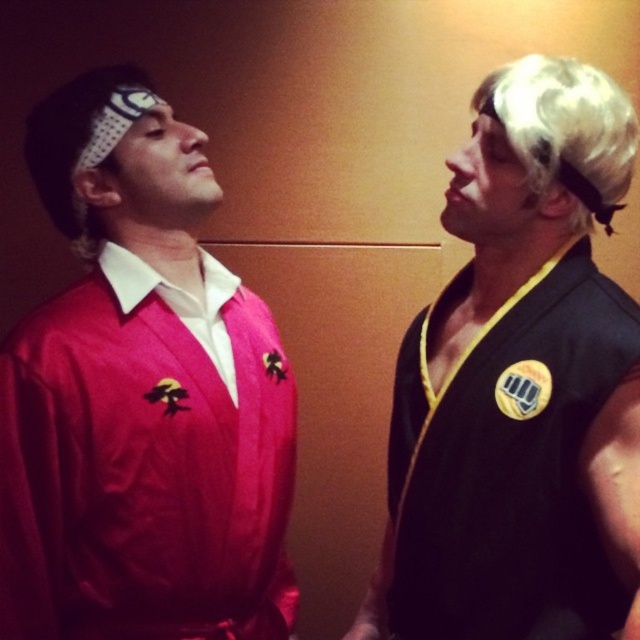
Who is positioned more to the right, matte pink sweater at left or black matte vest at right?

black matte vest at right is more to the right.

Is matte pink sweater at left wider than black matte vest at right?

Yes, matte pink sweater at left is wider than black matte vest at right.

Where is `matte pink sweater at left`? Image resolution: width=640 pixels, height=640 pixels. matte pink sweater at left is located at coordinates (140, 397).

The width and height of the screenshot is (640, 640). What are the coordinates of `matte pink sweater at left` in the screenshot? It's located at (140, 397).

Is point (272, 328) more distant than point (573, 224)?

Yes, point (272, 328) is behind point (573, 224).

Is matte pink sweater at left in front of blonde synthetic wig at upper right?

No, matte pink sweater at left is further to the viewer.

Between point (212, 204) and point (605, 163), which one is positioned behind?

Positioned behind is point (212, 204).

Locate an element on the screen. matte pink sweater at left is located at coordinates (140, 397).

Based on the photo, is black matte vest at right thinner than blonde synthetic wig at upper right?

Incorrect, black matte vest at right's width is not less than blonde synthetic wig at upper right's.

In the scene shown: Can you confirm if black matte vest at right is positioned below blonde synthetic wig at upper right?

Yes, black matte vest at right is below blonde synthetic wig at upper right.

The image size is (640, 640). Describe the element at coordinates (518, 385) in the screenshot. I see `black matte vest at right` at that location.

You are a GUI agent. You are given a task and a screenshot of the screen. Output one action in this format:
    pyautogui.click(x=<x>, y=<y>)
    Task: Click on the black matte vest at right
    The height and width of the screenshot is (640, 640).
    Given the screenshot: What is the action you would take?
    pyautogui.click(x=518, y=385)